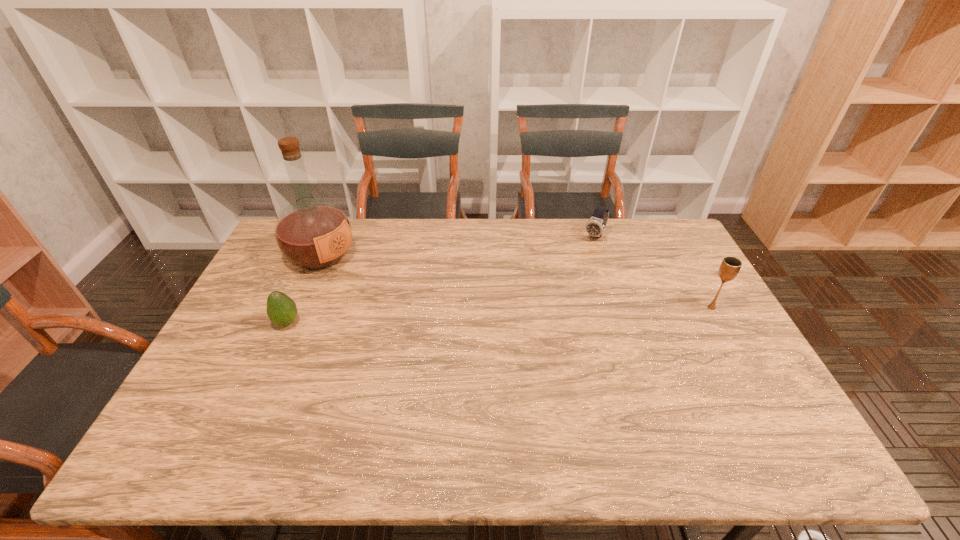
The image size is (960, 540). Find the location of `vacant point located between the nearest object and the rightmost object`. vacant point located between the nearest object and the rightmost object is located at coordinates (499, 315).

What are the coordinates of `free space between the avocado and the tallest object` in the screenshot? It's located at (304, 289).

Locate an element on the screen. free spot between the liquor and the avocado is located at coordinates (304, 289).

Select which object is the second closest to the avocado. Please provide its 2D coordinates. Your answer should be formatted as a tuple, i.e. [(x, y)], where the tuple contains the x and y coordinates of a point satisfying the conditions above.

[(595, 227)]

Locate an element on the screen. The width and height of the screenshot is (960, 540). the closest object to the nearest object is located at coordinates (313, 233).

You are a GUI agent. You are given a task and a screenshot of the screen. Output one action in this format:
    pyautogui.click(x=<x>, y=<y>)
    Task: Click on the vacant space that satisfies the following two spatial constraints: 1. on the back side of the avocado; 2. on the left side of the third object from left to right
    The width and height of the screenshot is (960, 540).
    Given the screenshot: What is the action you would take?
    pyautogui.click(x=325, y=237)

You are a GUI agent. You are given a task and a screenshot of the screen. Output one action in this format:
    pyautogui.click(x=<x>, y=<y>)
    Task: Click on the vacant region that satisfies the following two spatial constraints: 1. on the front side of the liquor; 2. on the left side of the third shortest object
    This screenshot has width=960, height=540.
    Given the screenshot: What is the action you would take?
    pyautogui.click(x=299, y=307)

Where is `blank space that satisfies the following two spatial constraints: 1. on the back side of the third object from left to right; 2. on the right side of the liquor`? This screenshot has height=540, width=960. blank space that satisfies the following two spatial constraints: 1. on the back side of the third object from left to right; 2. on the right side of the liquor is located at coordinates (329, 237).

Where is `blank space that satisfies the following two spatial constraints: 1. on the front side of the watch; 2. on the right side of the third shortest object`? blank space that satisfies the following two spatial constraints: 1. on the front side of the watch; 2. on the right side of the third shortest object is located at coordinates (618, 307).

You are a GUI agent. You are given a task and a screenshot of the screen. Output one action in this format:
    pyautogui.click(x=<x>, y=<y>)
    Task: Click on the free spot that satisfies the following two spatial constraints: 1. on the back side of the tallest object; 2. on the right side of the watch
    The image size is (960, 540).
    Given the screenshot: What is the action you would take?
    pyautogui.click(x=329, y=237)